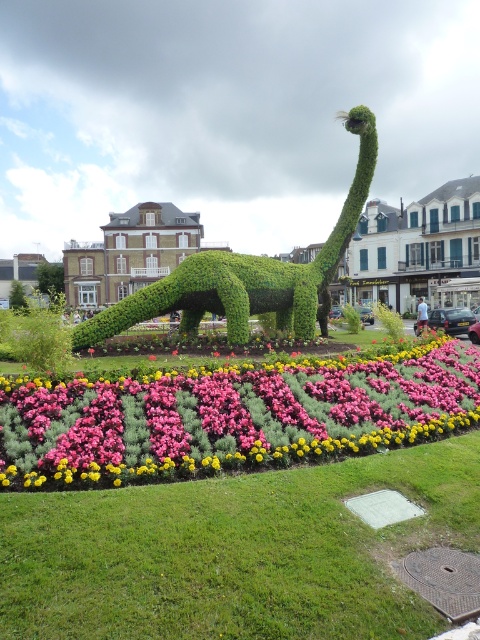
You are a gardener planning to plant a new row of flowers between the pink matte flowers at center and the green leafy plant at center. Which of the two should you place closer to the edge of the garden bed to ensure the new row has enough space?

The pink matte flowers at center has a lesser width compared to the green leafy plant at center, so you should place the pink matte flowers at center closer to the edge of the garden bed to accommodate the new row of flowers.

You are a gardener who wants to plant a new flower that needs more sunlight. You see the pink matte flowers at center and the green leafy plant at center. Which one is shorter so that the new flower can be placed in front of it to ensure it gets enough sunlight?

The pink matte flowers at center has a lesser height compared to the green leafy plant at center, so the new flower should be placed in front of the pink matte flowers at center to ensure it receives adequate sunlight.